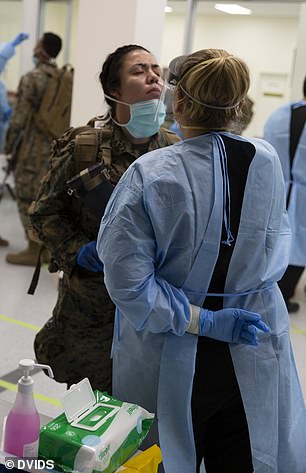
Locate an element on the screen. This screenshot has height=473, width=306. lights is located at coordinates (235, 10), (166, 9).